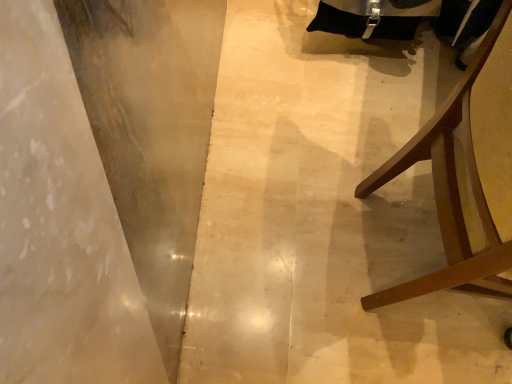
Find the location of `vacant location below brown wood chair at right (from a real-world perspective)`. vacant location below brown wood chair at right (from a real-world perspective) is located at coordinates (412, 267).